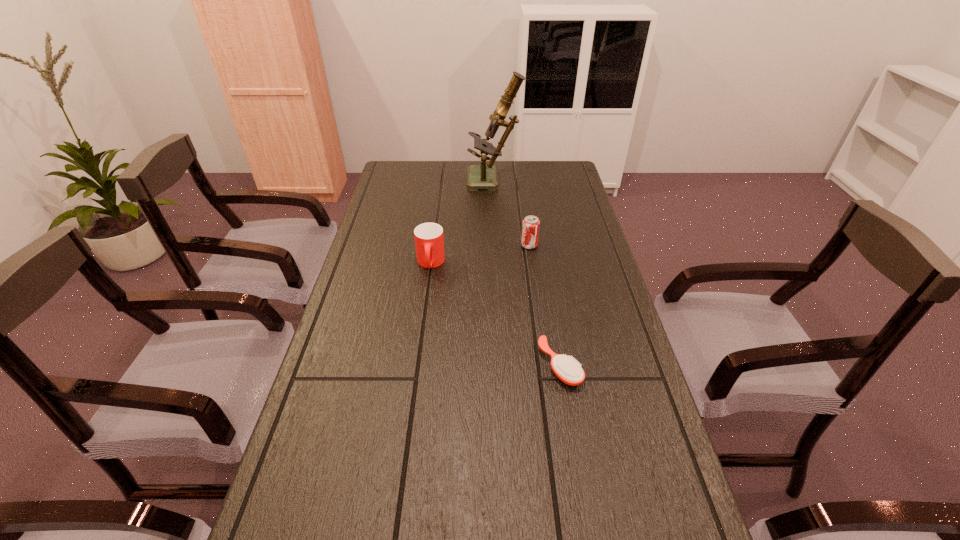
Identify the location of free space located on the side of the cup with the handle. (421, 331).

This screenshot has width=960, height=540. I want to click on vacant space located on the right of the soda can, so click(x=581, y=245).

The image size is (960, 540). In order to click on free space located 0.320m on the back of the hairbrush in this screenshot , I will do `click(542, 264)`.

Identify the location of object present at the far edge. (483, 176).

I want to click on object that is positioned at the right edge, so click(568, 370).

The height and width of the screenshot is (540, 960). I want to click on vacant space at the far edge of the desktop, so click(x=426, y=174).

I want to click on vacant space at the left edge, so click(x=384, y=253).

The height and width of the screenshot is (540, 960). I want to click on vacant space at the right edge of the desktop, so click(x=641, y=521).

At what (x,y) coordinates should I click in order to perform the action: click on blank space at the far right corner. Please return your answer as a coordinate pair (x, y). The width and height of the screenshot is (960, 540). Looking at the image, I should click on (570, 176).

Locate an element on the screen. The image size is (960, 540). empty space between the cup and the tallest object is located at coordinates (462, 222).